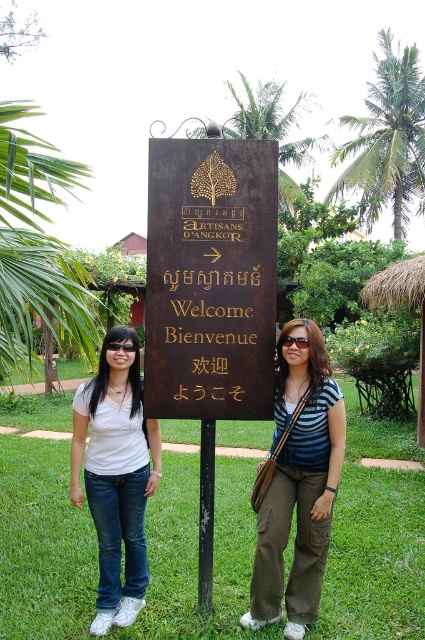
Locate an element on the screen. brown polished wood sign at center is located at coordinates (210, 278).

The image size is (425, 640). I want to click on brown polished wood sign at center, so click(210, 278).

Is brown polished wood sign at center to the left of white matte t-shirt at left from the viewer's perspective?

No, brown polished wood sign at center is not to the left of white matte t-shirt at left.

Can you confirm if brown polished wood sign at center is positioned above white matte t-shirt at left?

Yes.

Where is `brown polished wood sign at center`? brown polished wood sign at center is located at coordinates (210, 278).

Who is shorter, striped fabric shirt at center or white matte t-shirt at left?

Standing shorter between the two is white matte t-shirt at left.

Measure the distance from striped fabric shirt at center to white matte t-shirt at left.

striped fabric shirt at center is 3.75 feet from white matte t-shirt at left.

What do you see at coordinates (297, 483) in the screenshot?
I see `striped fabric shirt at center` at bounding box center [297, 483].

Locate an element on the screen. striped fabric shirt at center is located at coordinates (297, 483).